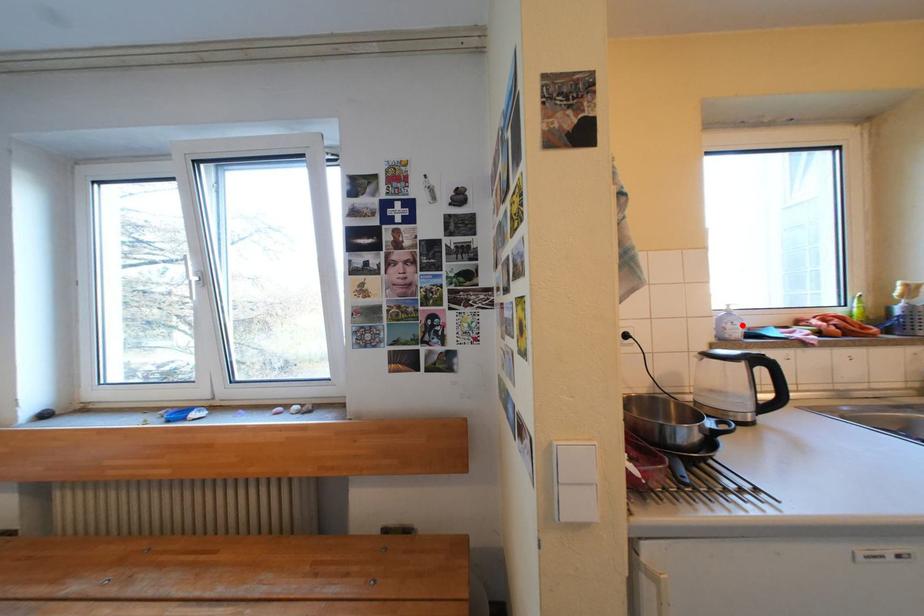
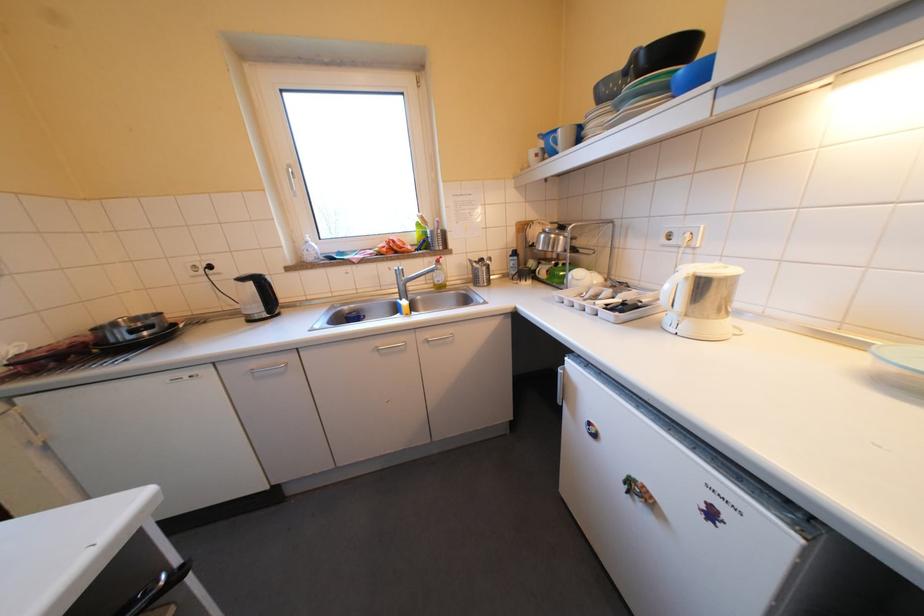
Where in the second image is the point corresponding to the highlighted location from the first image?

(319, 252)